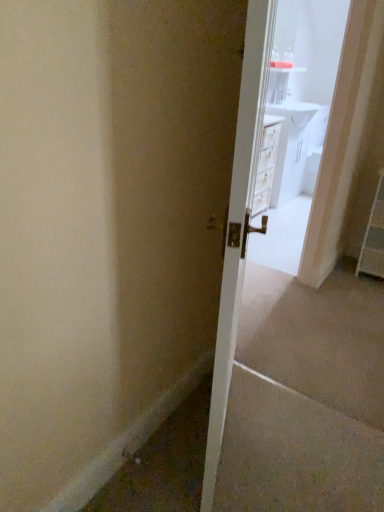
I want to click on white plastic dresser at right, so (x=374, y=237).

This screenshot has width=384, height=512. I want to click on white plastic dresser at right, so click(374, 237).

Looking at this image, is white glossy vanity at upper center situated inside white glossy door at center or outside?

white glossy vanity at upper center lies outside white glossy door at center.

Consider the image. Is the position of white glossy vanity at upper center less distant than that of white glossy door at center?

No, it is not.

Is white glossy vanity at upper center positioned with its back to white glossy door at center?

white glossy vanity at upper center is not turned away from white glossy door at center.

Which of these two, white plastic dresser at right or white glossy vanity at upper center, is smaller?

With smaller size is white plastic dresser at right.

Is point (381, 260) closer or farther from the camera than point (305, 159)?

Clearly, point (381, 260) is closer to the camera than point (305, 159).

Is white plastic dresser at right inside the boundaries of white glossy vanity at upper center, or outside?

white plastic dresser at right cannot be found inside white glossy vanity at upper center.

Relative to white glossy door at center, is white plastic dresser at right in front or behind?

Visually, white plastic dresser at right is located behind white glossy door at center.

Is white plastic dresser at right not close to white glossy door at center?

Yes, white plastic dresser at right and white glossy door at center are located far from each other.

From the image's perspective, between white plastic dresser at right and white glossy door at center, which one is located above?

white plastic dresser at right, from the image's perspective.

I want to click on dresser below the white glossy vanity at upper center (from the image's perspective), so click(x=374, y=237).

Considering the points (303, 144) and (379, 275), which point is in front, point (303, 144) or point (379, 275)?

The point (379, 275) is closer to the camera.

In terms of width, does white glossy vanity at upper center look wider or thinner when compared to white plastic dresser at right?

white glossy vanity at upper center is thinner than white plastic dresser at right.

Does white glossy vanity at upper center appear on the right side of white plastic dresser at right?

No, white glossy vanity at upper center is not to the right of white plastic dresser at right.

Looking at this image, which is more to the right, white glossy door at center or white plastic dresser at right?

From the viewer's perspective, white plastic dresser at right appears more on the right side.

From a real-world perspective, between white glossy door at center and white plastic dresser at right, who is vertically higher?

white glossy door at center is physically above.

Could you tell me if white glossy door at center is facing white plastic dresser at right?

No, white glossy door at center does not turn towards white plastic dresser at right.

From the image's perspective, is white glossy door at center located above white plastic dresser at right?

Actually, white glossy door at center appears below white plastic dresser at right in the image.

Is the depth of white glossy door at center greater than that of white glossy vanity at upper center?

No, white glossy door at center is in front of white glossy vanity at upper center.

Locate an element on the screen. door in front of the white glossy vanity at upper center is located at coordinates (238, 222).

Can you confirm if white glossy door at center is thinner than white glossy vanity at upper center?

Indeed, white glossy door at center has a lesser width compared to white glossy vanity at upper center.

From the image's perspective, is white glossy door at center located above or below white glossy vanity at upper center?

white glossy door at center is below white glossy vanity at upper center.

Find the location of a particular element. vanity that is on the right side of white glossy door at center is located at coordinates (294, 146).

Locate an element on the screen. dresser that appears below the white glossy vanity at upper center (from a real-world perspective) is located at coordinates (374, 237).

In the scene shown: Which object lies nearer to the anchor point white plastic dresser at right, white glossy door at center or white glossy vanity at upper center?

The object closer to white plastic dresser at right is white glossy door at center.

When comparing their distances from white glossy door at center, does white plastic dresser at right or white glossy vanity at upper center seem further?

white glossy vanity at upper center lies further to white glossy door at center than the other object.

Estimate the real-world distances between objects in this image. Which object is closer to white plastic dresser at right, white glossy vanity at upper center or white glossy door at center?

white glossy door at center lies closer to white plastic dresser at right than the other object.

From the image, which object appears to be farther from white glossy vanity at upper center, white plastic dresser at right or white glossy door at center?

white glossy door at center lies further to white glossy vanity at upper center than the other object.

Which object lies nearer to the anchor point white glossy vanity at upper center, white glossy door at center or white plastic dresser at right?

Based on the image, white plastic dresser at right appears to be nearer to white glossy vanity at upper center.

Which object lies nearer to the anchor point white glossy door at center, white glossy vanity at upper center or white plastic dresser at right?

Based on the image, white plastic dresser at right appears to be nearer to white glossy door at center.

At what (x,y) coordinates should I click in order to perform the action: click on dresser between white glossy door at center and white glossy vanity at upper center from front to back. Please return your answer as a coordinate pair (x, y). Looking at the image, I should click on (374, 237).